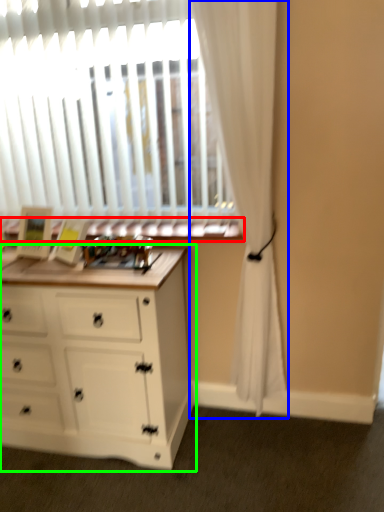
Question: Which object is positioned closest to window sill (highlighted by a red box)? Select from curtain (highlighted by a blue box) and chest of drawers (highlighted by a green box).

Choices:
 (A) curtain
 (B) chest of drawers

Answer: (A)